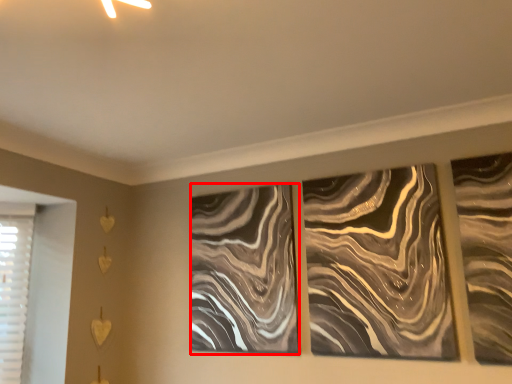
Question: In this image, where is design (annotated by the red box) located relative to design?

Choices:
 (A) right
 (B) left

Answer: (B)